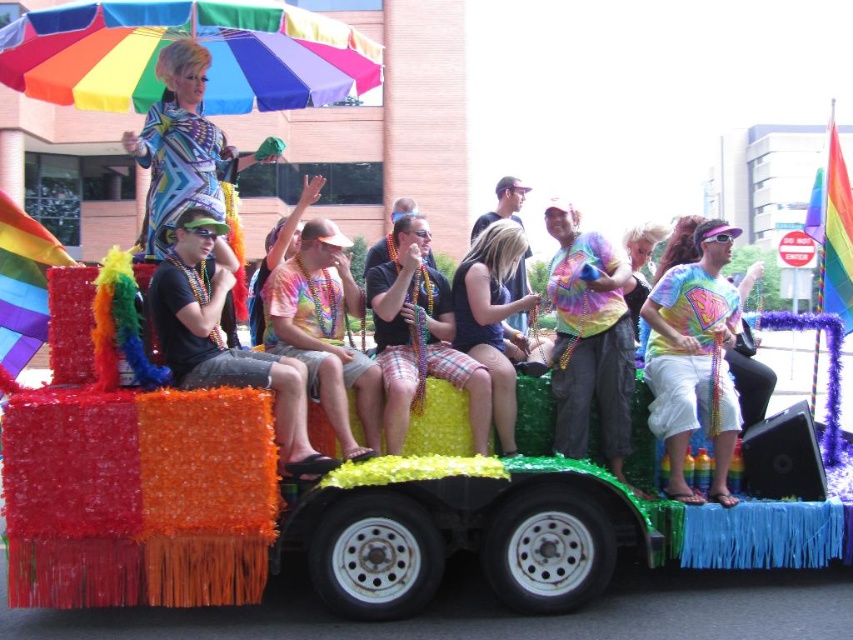
Does rainbow tie-dye shirt at center have a lesser height compared to plaid shorts at center?

In fact, rainbow tie-dye shirt at center may be taller than plaid shorts at center.

Can you confirm if rainbow tie-dye shirt at center is thinner than plaid shorts at center?

Yes, rainbow tie-dye shirt at center is thinner than plaid shorts at center.

At what (x,y) coordinates should I click in order to perform the action: click on rainbow tie-dye shirt at center. Please return your answer as a coordinate pair (x, y). The image size is (853, 640). Looking at the image, I should click on (692, 352).

Between point (619, 465) and point (318, 294), which one is positioned in front?

Point (619, 465) is more forward.

This screenshot has width=853, height=640. I want to click on neon tie-dye shirt at center, so click(x=589, y=337).

Does neon tie-dye shirt at center have a smaller size compared to matte black shirt at center?

Yes.

Can you confirm if neon tie-dye shirt at center is thinner than matte black shirt at center?

Yes, neon tie-dye shirt at center is thinner than matte black shirt at center.

Is point (566, 353) positioned behind point (165, 298)?

Yes, it is behind point (165, 298).

At what (x,y) coordinates should I click in order to perform the action: click on neon tie-dye shirt at center. Please return your answer as a coordinate pair (x, y). This screenshot has width=853, height=640. Looking at the image, I should click on (589, 337).